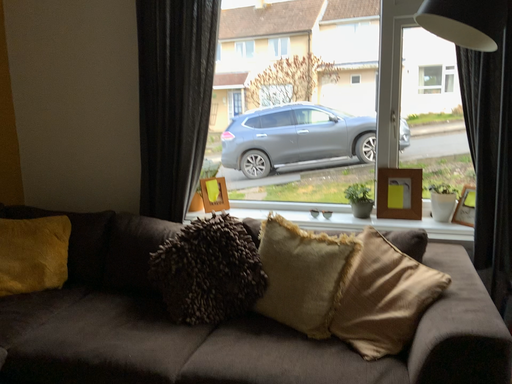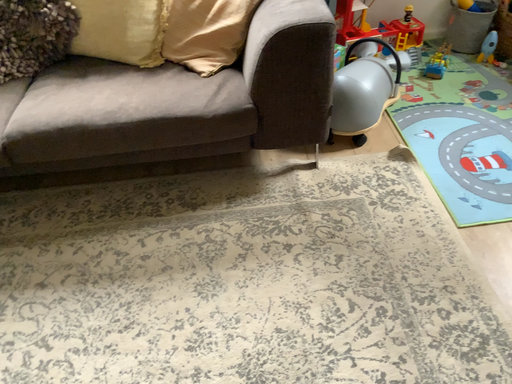
Question: Which way did the camera rotate in the video?

Choices:
 (A) rotated left
 (B) rotated right

Answer: (B)